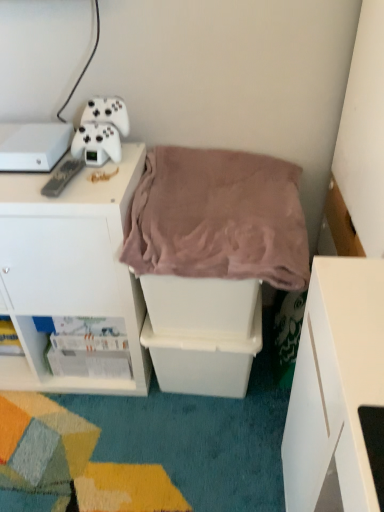
Locate an element on the screen. white matte game controller at upper left is located at coordinates (101, 131).

Find the location of a particular element. white glossy magazine at lower left, the first shelf positioned from the left is located at coordinates 86,346.

In the scene shown: What is the approximate height of black plastic remote at upper left?

black plastic remote at upper left is 1.22 inches in height.

Find the location of a particular element. The image size is (384, 512). white matte game controller at upper left is located at coordinates (101, 131).

Is white matte game controller at upper left positioned with its back to white glossy magazine at lower left, the first shelf positioned from the left?

white matte game controller at upper left is not turned away from white glossy magazine at lower left, the first shelf positioned from the left.

Would you say white matte game controller at upper left is outside white glossy magazine at lower left, the first shelf positioned from the left?

Yes, white matte game controller at upper left is outside of white glossy magazine at lower left, the first shelf positioned from the left.

Is point (89, 106) positioned in front of point (77, 341)?

That is True.

Which object is more forward, white plastic cabinet at upper left or white glossy magazine at lower left, which ranks as the second shelf in right-to-left order?

white plastic cabinet at upper left.

Could you tell me if white plastic cabinet at upper left is turned towards white glossy magazine at lower left, which ranks as the second shelf in right-to-left order?

Yes, white plastic cabinet at upper left is turned towards white glossy magazine at lower left, which ranks as the second shelf in right-to-left order.

From the image's perspective, is white plastic cabinet at upper left below white glossy magazine at lower left, the first shelf positioned from the left?

Incorrect, from the image's perspective, white plastic cabinet at upper left is higher than white glossy magazine at lower left, the first shelf positioned from the left.

From a real-world perspective, which is physically below, white plastic cabinet at upper left or white glossy magazine at lower left, the first shelf positioned from the left?

white glossy magazine at lower left, the first shelf positioned from the left.

Which object is closer to the camera taking this photo, white plastic cabinet at upper left or mauve plush blanket at center?

mauve plush blanket at center is closer to the camera.

Considering the relative positions of white plastic cabinet at upper left and mauve plush blanket at center in the image provided, is white plastic cabinet at upper left to the right of mauve plush blanket at center from the viewer's perspective?

No.

How distant is white plastic cabinet at upper left from mauve plush blanket at center?

white plastic cabinet at upper left and mauve plush blanket at center are 10.68 inches apart from each other.

Considering the sizes of objects white plastic cabinet at upper left and mauve plush blanket at center in the image provided, who is shorter, white plastic cabinet at upper left or mauve plush blanket at center?

Standing shorter between the two is mauve plush blanket at center.

Is white glossy magazine at lower left, which ranks as the second shelf in right-to-left order, oriented away from white plastic cabinet at upper left?

Yes, white glossy magazine at lower left, which ranks as the second shelf in right-to-left order, is facing away from white plastic cabinet at upper left.

Is the depth of white glossy magazine at lower left, which ranks as the second shelf in right-to-left order, less than that of white plastic cabinet at upper left?

No, the depth of white glossy magazine at lower left, which ranks as the second shelf in right-to-left order, is greater than that of white plastic cabinet at upper left.

The width and height of the screenshot is (384, 512). What are the coordinates of `the 1st shelf counting from the right side of the white plastic cabinet at upper left` in the screenshot? It's located at (86, 346).

Can we say white glossy magazine at lower left, the first shelf positioned from the left, lies outside white matte game controller at upper left?

Yes, white glossy magazine at lower left, the first shelf positioned from the left, is located beyond the bounds of white matte game controller at upper left.

From the image's perspective, between white glossy magazine at lower left, the first shelf positioned from the left, and white matte game controller at upper left, which one is located above?

white matte game controller at upper left appears higher in the image.

Considering the sizes of white glossy magazine at lower left, which ranks as the second shelf in right-to-left order, and white matte game controller at upper left in the image, is white glossy magazine at lower left, which ranks as the second shelf in right-to-left order, taller or shorter than white matte game controller at upper left?

In the image, white glossy magazine at lower left, which ranks as the second shelf in right-to-left order, appears to be shorter than white matte game controller at upper left.

Can you confirm if white glossy magazine at lower left, the first shelf positioned from the left, is thinner than white matte game controller at upper left?

Incorrect, the width of white glossy magazine at lower left, the first shelf positioned from the left, is not less than that of white matte game controller at upper left.

Is mauve plush blanket at center positioned with its back to black plastic remote at upper left?

No, mauve plush blanket at center's orientation is not away from black plastic remote at upper left.

Which is less distant, (x=257, y=269) or (x=44, y=191)?

Positioned in front is point (x=257, y=269).

Is mauve plush blanket at center wider than black plastic remote at upper left?

Yes.

Where is `blanket below the black plastic remote at upper left (from a real-world perspective)`? The height and width of the screenshot is (512, 384). blanket below the black plastic remote at upper left (from a real-world perspective) is located at coordinates (218, 218).

Who is taller, white matte game controller at upper left or white plastic storage bin at center, placed as the second shelf when sorted from left to right?

white plastic storage bin at center, placed as the second shelf when sorted from left to right.

The width and height of the screenshot is (384, 512). I want to click on equipment above the white plastic storage bin at center, the first shelf in the right-to-left sequence (from the image's perspective), so click(x=101, y=131).

Are white matte game controller at upper left and white plastic storage bin at center, the first shelf in the right-to-left sequence, making contact?

No, white matte game controller at upper left is not beside white plastic storage bin at center, the first shelf in the right-to-left sequence.

Consider the image. Can you confirm if white matte game controller at upper left is positioned to the right of white plastic storage bin at center, placed as the second shelf when sorted from left to right?

No, white matte game controller at upper left is not to the right of white plastic storage bin at center, placed as the second shelf when sorted from left to right.

At what (x,y) coordinates should I click in order to perform the action: click on equipment above the white glossy magazine at lower left, the first shelf positioned from the left (from a real-world perspective). Please return your answer as a coordinate pair (x, y). The height and width of the screenshot is (512, 384). Looking at the image, I should click on (101, 131).

Identify the location of cabinetry to the left of white glossy magazine at lower left, which ranks as the second shelf in right-to-left order. Image resolution: width=384 pixels, height=512 pixels. (70, 269).

From the image, which object appears to be farther from white glossy magazine at lower left, which ranks as the second shelf in right-to-left order, white plastic storage bin at center, the first shelf in the right-to-left sequence, or mauve plush blanket at center?

mauve plush blanket at center is further to white glossy magazine at lower left, which ranks as the second shelf in right-to-left order.

Which object lies further to the anchor point white glossy magazine at lower left, the first shelf positioned from the left, white plastic cabinet at upper left or white plastic storage bin at center, placed as the second shelf when sorted from left to right?

Among the two, white plastic storage bin at center, placed as the second shelf when sorted from left to right, is located further to white glossy magazine at lower left, the first shelf positioned from the left.

Estimate the real-world distances between objects in this image. Which object is closer to white plastic storage bin at center, placed as the second shelf when sorted from left to right, black plastic remote at upper left or white glossy magazine at lower left, which ranks as the second shelf in right-to-left order?

white glossy magazine at lower left, which ranks as the second shelf in right-to-left order, lies closer to white plastic storage bin at center, placed as the second shelf when sorted from left to right, than the other object.

Looking at the image, which one is located further to white glossy magazine at lower left, the first shelf positioned from the left, white plastic storage bin at center, placed as the second shelf when sorted from left to right, or black plastic remote at upper left?

Among the two, black plastic remote at upper left is located further to white glossy magazine at lower left, the first shelf positioned from the left.

Based on their spatial positions, is white plastic storage bin at center, placed as the second shelf when sorted from left to right, or white glossy magazine at lower left, which ranks as the second shelf in right-to-left order, closer to white matte game controller at upper left?

Based on the image, white glossy magazine at lower left, which ranks as the second shelf in right-to-left order, appears to be nearer to white matte game controller at upper left.

From the image, which object appears to be nearer to black plastic remote at upper left, white glossy magazine at lower left, which ranks as the second shelf in right-to-left order, or white plastic cabinet at upper left?

Among the two, white plastic cabinet at upper left is located nearer to black plastic remote at upper left.

Estimate the real-world distances between objects in this image. Which object is further from white matte game controller at upper left, white plastic cabinet at upper left or white plastic storage bin at center, the first shelf in the right-to-left sequence?

Among the two, white plastic storage bin at center, the first shelf in the right-to-left sequence, is located further to white matte game controller at upper left.

When comparing their distances from white matte game controller at upper left, does white plastic cabinet at upper left or white glossy magazine at lower left, which ranks as the second shelf in right-to-left order, seem closer?

white plastic cabinet at upper left is closer to white matte game controller at upper left.

At what (x,y) coordinates should I click in order to perform the action: click on cabinetry between black plastic remote at upper left and white glossy magazine at lower left, which ranks as the second shelf in right-to-left order, in the vertical direction. Please return your answer as a coordinate pair (x, y). Looking at the image, I should click on (70, 269).

Image resolution: width=384 pixels, height=512 pixels. Identify the location of shelf between black plastic remote at upper left and white glossy magazine at lower left, the first shelf positioned from the left, in the up-down direction. (204, 360).

This screenshot has height=512, width=384. Find the location of `blanket between white matte game controller at upper left and white plastic storage bin at center, placed as the second shelf when sorted from left to right, in the vertical direction`. blanket between white matte game controller at upper left and white plastic storage bin at center, placed as the second shelf when sorted from left to right, in the vertical direction is located at coordinates (218, 218).

In order to click on cabinetry between white matte game controller at upper left and white plastic storage bin at center, placed as the second shelf when sorted from left to right, in the vertical direction in this screenshot , I will do `click(70, 269)`.